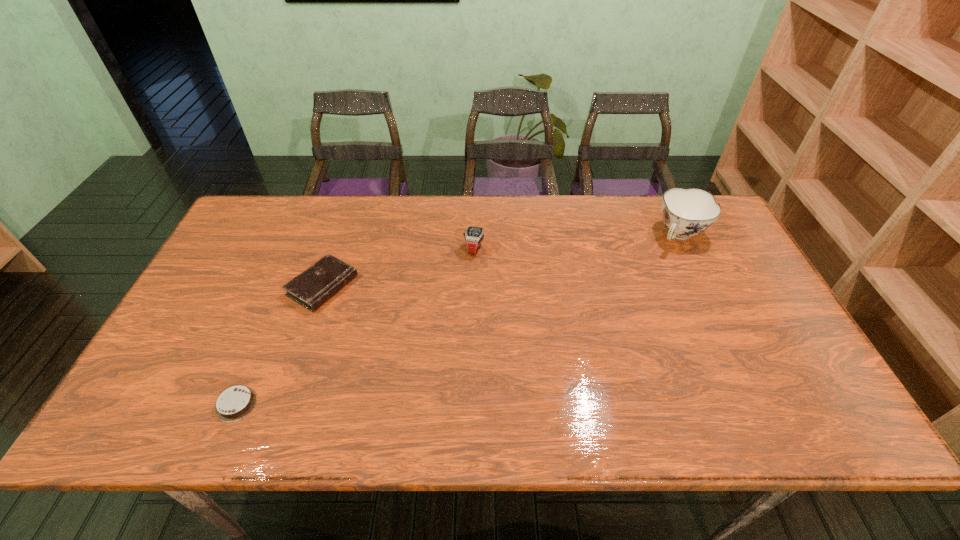
You are a GUI agent. You are given a task and a screenshot of the screen. Output one action in this format:
    pyautogui.click(x=<x>, y=<y>)
    Task: Click on the empty space between the third shortest object and the second nearest object
    The width and height of the screenshot is (960, 540).
    Given the screenshot: What is the action you would take?
    pyautogui.click(x=398, y=267)

Locate which object is the closest to the diary. Please provide its 2D coordinates. Your answer should be formatted as a tuple, i.e. [(x, y)], where the tuple contains the x and y coordinates of a point satisfying the conditions above.

[(235, 403)]

At what (x,y) coordinates should I click in order to perform the action: click on object that is the third nearest to the third object from left to right. Please return your answer as a coordinate pair (x, y). Image resolution: width=960 pixels, height=540 pixels. Looking at the image, I should click on (235, 403).

In order to click on free space that satisfies the following two spatial constraints: 1. on the back side of the chocolate cake; 2. on the left side of the tallest object in this screenshot , I will do `click(307, 235)`.

Where is `free spot that satisfies the following two spatial constraints: 1. on the back side of the shortest object; 2. on the left side of the rightmost object`? The height and width of the screenshot is (540, 960). free spot that satisfies the following two spatial constraints: 1. on the back side of the shortest object; 2. on the left side of the rightmost object is located at coordinates (307, 235).

Locate an element on the screen. vacant space that satisfies the following two spatial constraints: 1. on the back side of the chocolate cake; 2. on the right side of the chinaware is located at coordinates (307, 235).